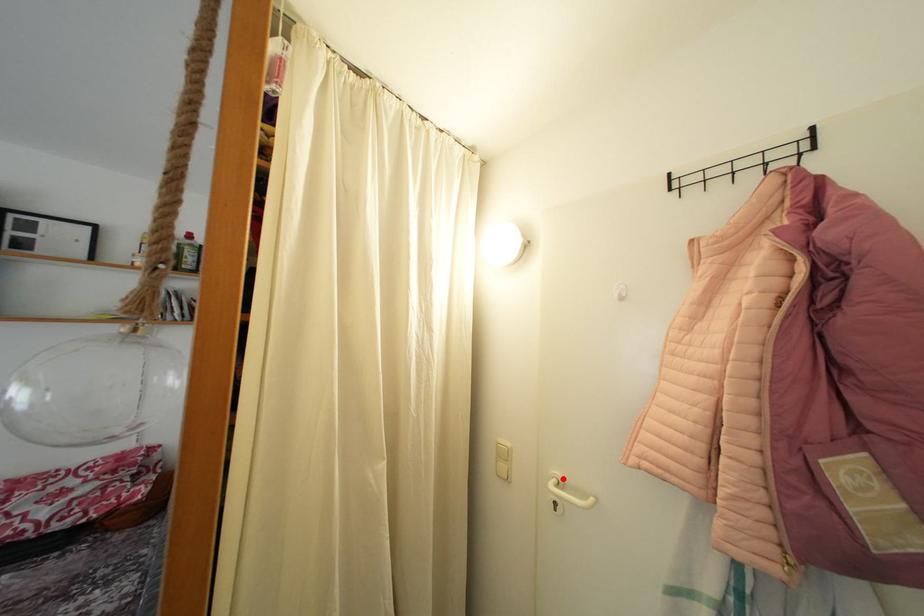
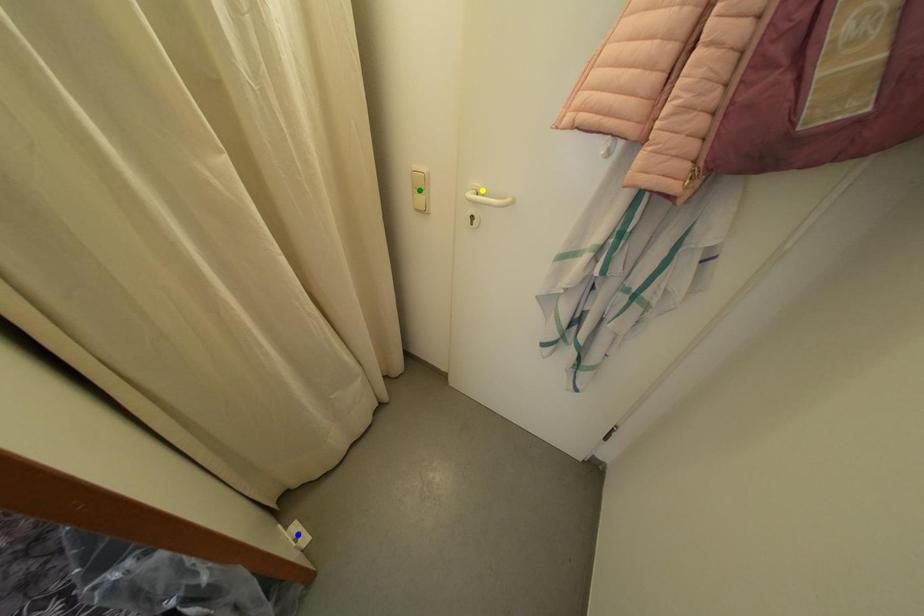
Question: I am providing you with two images of the same scene from different viewpoints. A red point is marked on the first image. You are given multiple points on the second image. Which spot in image 2 lines up with the point in image 1?

Choices:
 (A) green point
 (B) yellow point
 (C) blue point

Answer: (B)